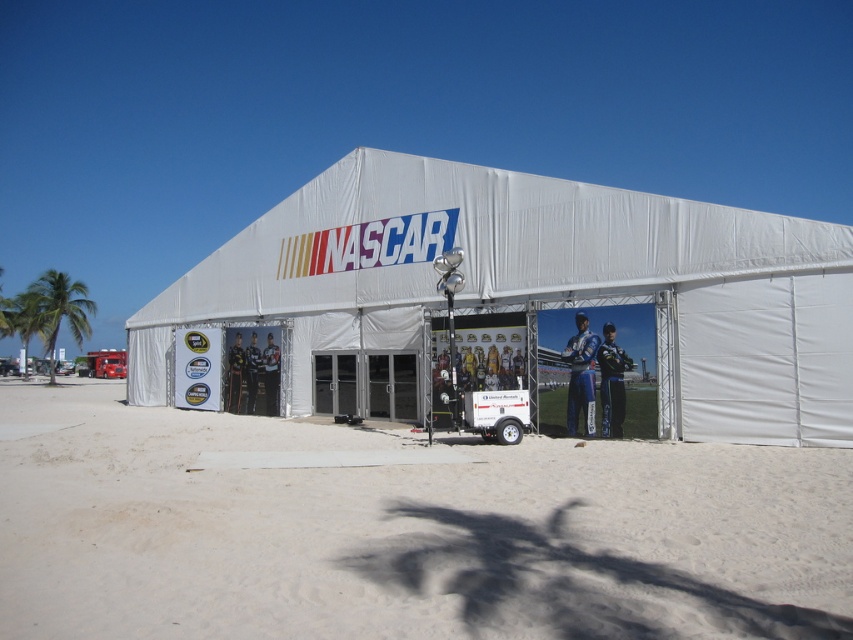
Question: Is matte black suit at center closer to the viewer compared to blue fabric suit at center?

Choices:
 (A) yes
 (B) no

Answer: (B)

Question: Which is farther from the white sand at lower center?

Choices:
 (A) blue fabric figure at center
 (B) blue racing suit at center
 (C) matte black suit at center
 (D) white fabric tent at center

Answer: (C)

Question: Is matte black racing suit at lower left below blue fabric suit at center?

Choices:
 (A) yes
 (B) no

Answer: (B)

Question: Which of the following is the farthest from the observer?

Choices:
 (A) blue fabric suit at center
 (B) blue racing suit at center
 (C) white sand at lower center

Answer: (A)

Question: Which point appears farthest from the camera in this image?

Choices:
 (A) (252, 362)
 (B) (773, 259)

Answer: (A)

Question: Is white fabric tent at center bigger than matte black racing suit at lower left?

Choices:
 (A) no
 (B) yes

Answer: (B)